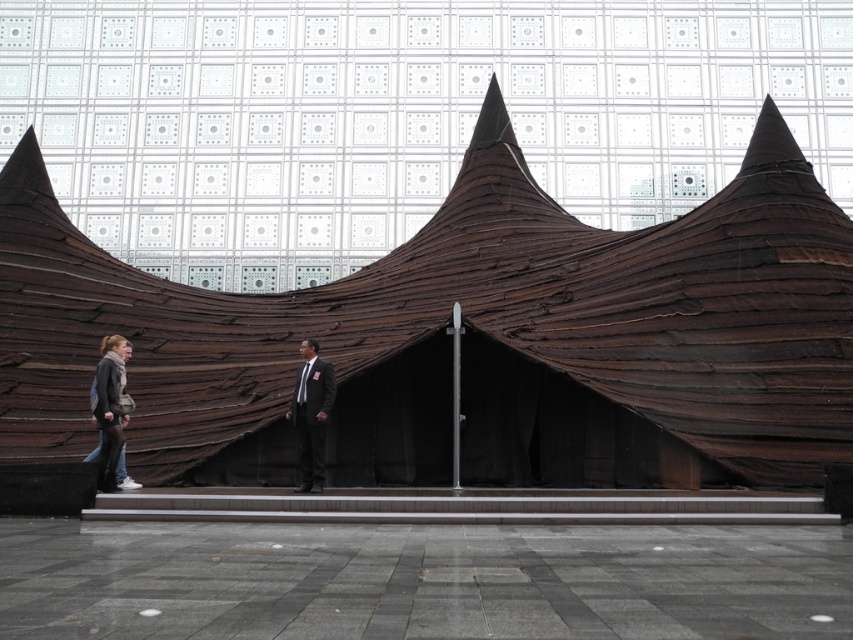
From the picture: Can you confirm if brown wood sculpture at center is positioned to the right of matte black suit at center?

Correct, you'll find brown wood sculpture at center to the right of matte black suit at center.

Is brown wood sculpture at center positioned before matte black suit at center?

Yes, brown wood sculpture at center is closer to the viewer.

Where is `brown wood sculpture at center`? The image size is (853, 640). brown wood sculpture at center is located at coordinates (465, 314).

Where is `brown wood sculpture at center`? brown wood sculpture at center is located at coordinates (465, 314).

Between matte black suit at center and matte gray jacket at lower left, which one is positioned higher?

matte black suit at center

Which is in front, point (297, 400) or point (108, 426)?

Point (108, 426)

Does point (315, 376) come closer to viewer compared to point (114, 416)?

No, (315, 376) is behind (114, 416).

The height and width of the screenshot is (640, 853). In order to click on matte black suit at center in this screenshot , I will do `click(311, 413)`.

Does brown wood sculpture at center appear over matte gray jacket at lower left?

Yes, brown wood sculpture at center is above matte gray jacket at lower left.

Is brown wood sculpture at center positioned before matte gray jacket at lower left?

That is False.

The height and width of the screenshot is (640, 853). I want to click on brown wood sculpture at center, so click(465, 314).